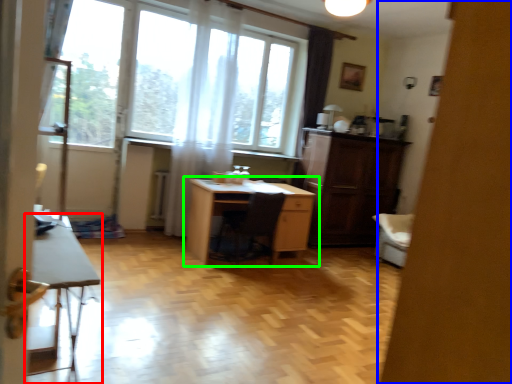
Question: Based on their relative distances, which object is farther from table (highlighted by a red box)? Choose from screen door (highlighted by a blue box) and desk (highlighted by a green box).

Choices:
 (A) screen door
 (B) desk

Answer: (B)